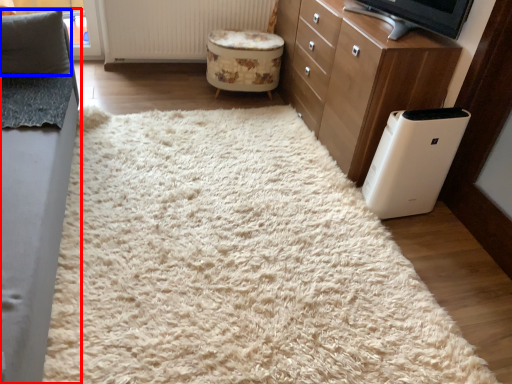
Question: Which object is closer to the camera taking this photo, furniture (highlighted by a red box) or pillow (highlighted by a blue box)?

Choices:
 (A) furniture
 (B) pillow

Answer: (A)